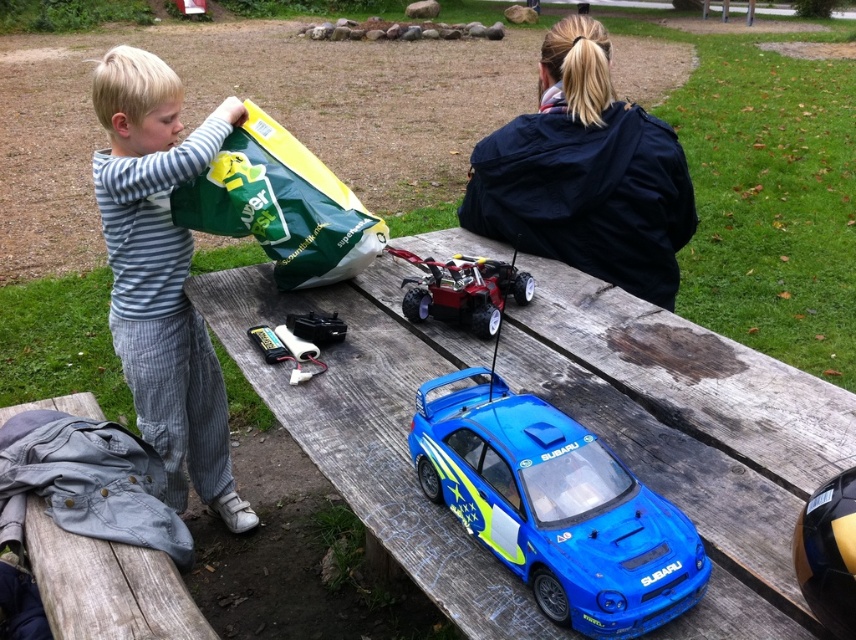
Between point (513, 499) and point (248, 186), which one is positioned in front?

Positioned in front is point (513, 499).

Is the position of blue glossy toy car at center less distant than that of green matte bag at upper left?

Yes, it is.

You are a GUI agent. You are given a task and a screenshot of the screen. Output one action in this format:
    pyautogui.click(x=<x>, y=<y>)
    Task: Click on the blue glossy toy car at center
    This screenshot has width=856, height=640.
    Given the screenshot: What is the action you would take?
    pyautogui.click(x=556, y=508)

Is blue plastic car at center positioned behind green matte bag at upper left?

No.

Find the location of a particular element. blue plastic car at center is located at coordinates (690, 433).

Identify the location of blue plastic car at center. (690, 433).

Is point (794, 490) closer to viewer compared to point (409, 316)?

Yes, it is in front of point (409, 316).

Is blue plastic car at center positioned in front of metallic red toy car at center?

That is True.

Is point (502, 627) farther from camera compared to point (516, 272)?

No, it is in front of (516, 272).

Where is `blue plastic car at center`? The image size is (856, 640). blue plastic car at center is located at coordinates (690, 433).